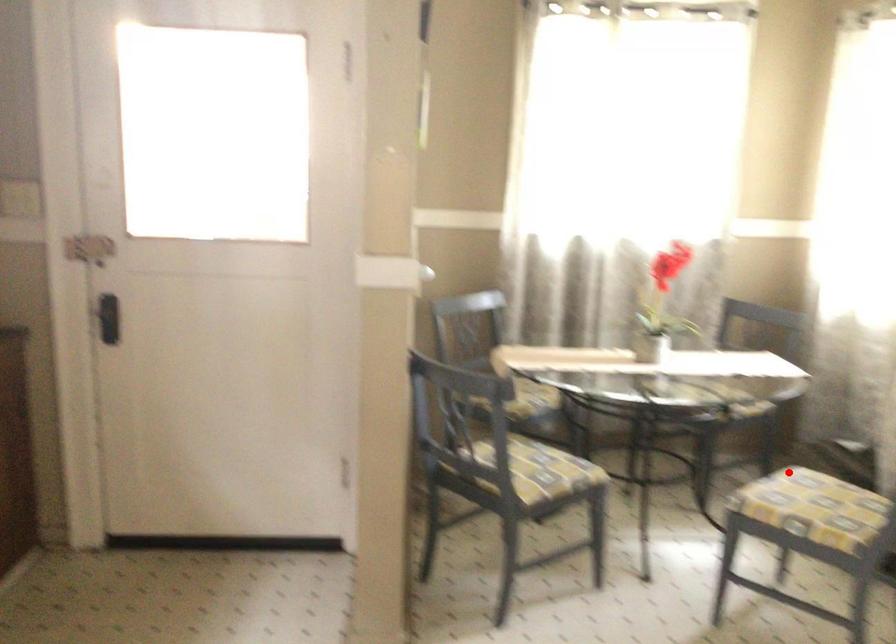
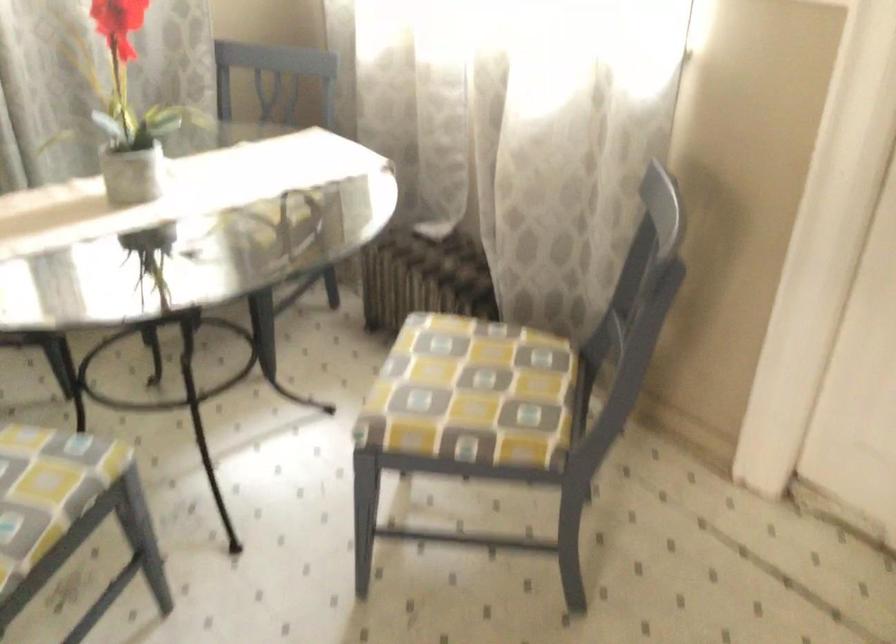
Question: I am providing you with two images of the same scene from different viewpoints. In image1, a red point is highlighted. Considering the same 3D point in image2, which of the following is correct?

Choices:
 (A) It is closer
 (B) It is farther

Answer: (A)